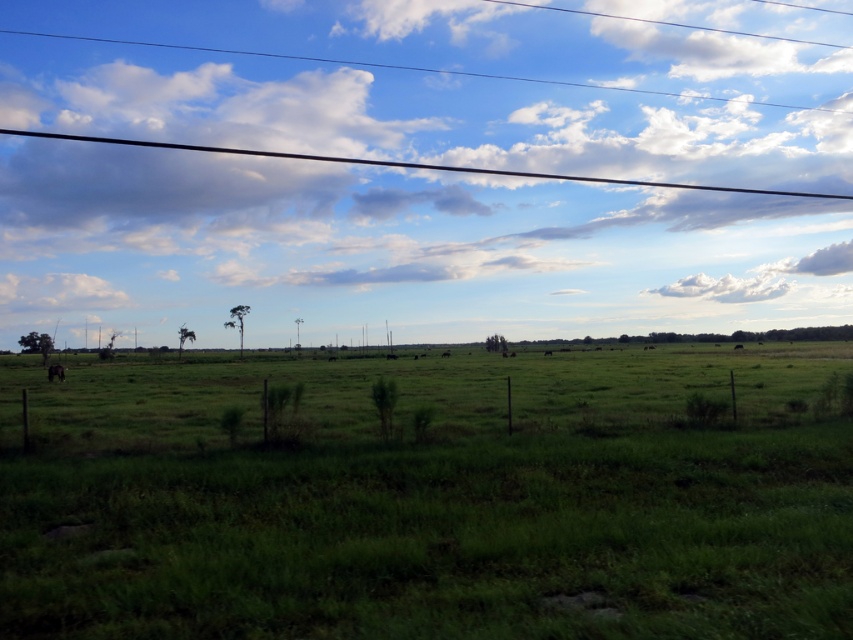
Who is shorter, white fluffy cloud at upper left or brown furry cow at lower left?

brown furry cow at lower left is shorter.

How far apart are white fluffy cloud at upper left and brown furry cow at lower left?

white fluffy cloud at upper left and brown furry cow at lower left are 85.97 meters apart from each other.

What are the coordinates of `white fluffy cloud at upper left` in the screenshot? It's located at (57, 292).